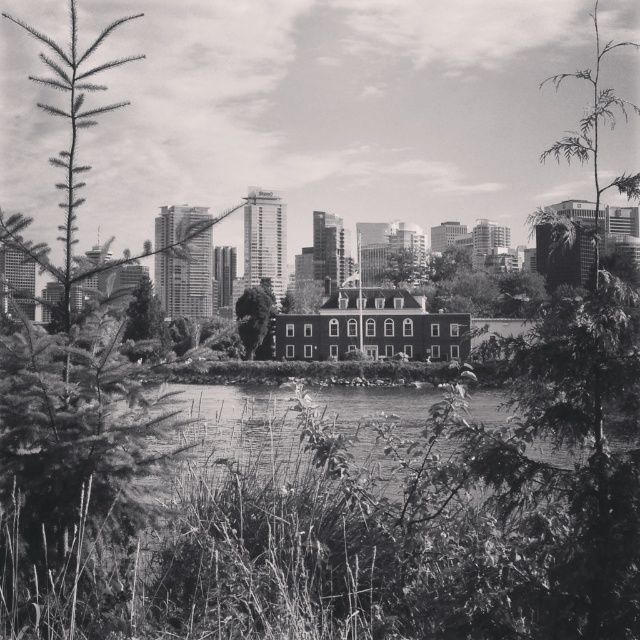
You are standing at the center of the image and want to find the smooth green tree at center. According to the scene description, where should you look?

The smooth green tree at center is located at point (256, 320), so you should look directly at the center of the image to find it.

You are a photographer standing in the serene urban landscape scene. You notice two trees at the center of the image, a smooth green tree at center and a green leafy tree at center. Which tree would cast a larger shadow on the ground?

The smooth green tree at center is bigger than the green leafy tree at center, so it would cast a larger shadow on the ground.